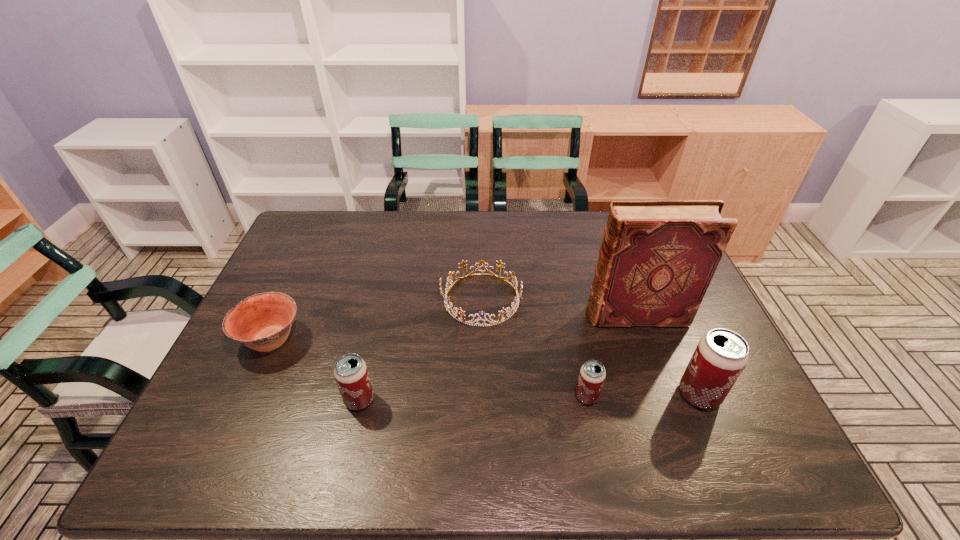
The image size is (960, 540). I want to click on beer can object that ranks as the second closest to the rightmost beer can, so click(351, 374).

What are the coordinates of `the second closest beer can to the second object from left to right` in the screenshot? It's located at (721, 355).

Locate an element on the screen. vacant region that satisfies the following two spatial constraints: 1. on the spine side of the second tallest object; 2. on the left side of the hardback book is located at coordinates (663, 394).

The width and height of the screenshot is (960, 540). I want to click on vacant space that satisfies the following two spatial constraints: 1. on the spine side of the tallest object; 2. on the front side of the leftmost beer can, so click(x=665, y=400).

The image size is (960, 540). Identify the location of free region that satisfies the following two spatial constraints: 1. on the back side of the fourth object from left to right; 2. on the left side of the fifth shortest object. (587, 394).

The height and width of the screenshot is (540, 960). In order to click on free region that satisfies the following two spatial constraints: 1. on the spine side of the hardback book; 2. on the front side of the fourth shortest object in this screenshot , I will do `click(665, 400)`.

Where is `free space that satisfies the following two spatial constraints: 1. on the back side of the second tallest object; 2. on the spine side of the hardback book`? free space that satisfies the following two spatial constraints: 1. on the back side of the second tallest object; 2. on the spine side of the hardback book is located at coordinates (665, 315).

What are the coordinates of `vacant region that satisfies the following two spatial constraints: 1. on the spine side of the tallest object; 2. on the back side of the rightmost beer can` in the screenshot? It's located at (663, 394).